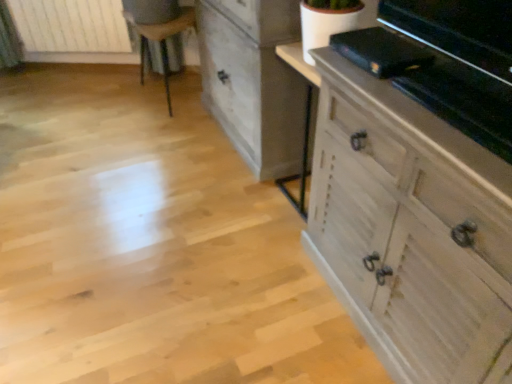
Identify the location of distressed white chest of drawers at center, which is the 1th chest of drawers in back-to-front order. (254, 81).

Describe the element at coordinates (163, 40) in the screenshot. I see `wooden chair at upper left` at that location.

Locate an element on the screen. white wood chest of drawers at right, which ranks as the 1th chest of drawers in front-to-back order is located at coordinates (409, 228).

In order to face white wood chest of drawers at right, the second chest of drawers positioned from the back, should I rotate leftwards or rightwards?

Rotate right and turn 23.214 degrees.

At what (x,y) coordinates should I click in order to perform the action: click on distressed white chest of drawers at center, which is the 1th chest of drawers in back-to-front order. Please return your answer as a coordinate pair (x, y). The height and width of the screenshot is (384, 512). Looking at the image, I should click on (254, 81).

From the image's perspective, which is below, wooden chair at upper left or distressed white chest of drawers at center, which is counted as the second chest of drawers, starting from the front?

From the image's view, distressed white chest of drawers at center, which is counted as the second chest of drawers, starting from the front, is below.

Does wooden chair at upper left touch distressed white chest of drawers at center, which is counted as the second chest of drawers, starting from the front?

No, wooden chair at upper left is not next to distressed white chest of drawers at center, which is counted as the second chest of drawers, starting from the front.

Would you say wooden chair at upper left is inside or outside distressed white chest of drawers at center, which is the 1th chest of drawers in back-to-front order?

wooden chair at upper left is not enclosed by distressed white chest of drawers at center, which is the 1th chest of drawers in back-to-front order.

Is wooden chair at upper left turned away from distressed white chest of drawers at center, which is the 1th chest of drawers in back-to-front order?

wooden chair at upper left is not turned away from distressed white chest of drawers at center, which is the 1th chest of drawers in back-to-front order.

From the image's perspective, is white wooden radiator at upper left positioned above or below distressed white chest of drawers at center, which is the 1th chest of drawers in back-to-front order?

Based on their image positions, white wooden radiator at upper left is located above distressed white chest of drawers at center, which is the 1th chest of drawers in back-to-front order.

Is distressed white chest of drawers at center, which is counted as the second chest of drawers, starting from the front, completely or partially inside white wooden radiator at upper left?

No, distressed white chest of drawers at center, which is counted as the second chest of drawers, starting from the front, is not inside white wooden radiator at upper left.

Considering the relative sizes of white wooden radiator at upper left and distressed white chest of drawers at center, which is counted as the second chest of drawers, starting from the front, in the image provided, is white wooden radiator at upper left bigger than distressed white chest of drawers at center, which is counted as the second chest of drawers, starting from the front,?

Incorrect, white wooden radiator at upper left is not larger than distressed white chest of drawers at center, which is counted as the second chest of drawers, starting from the front.

Is white wooden radiator at upper left facing away from distressed white chest of drawers at center, which is the 1th chest of drawers in back-to-front order?

No.

Based on the photo, from the image's perspective, is white wooden radiator at upper left over wooden chair at upper left?

Yes, from the image's perspective, white wooden radiator at upper left is over wooden chair at upper left.

Considering the relative sizes of white wooden radiator at upper left and wooden chair at upper left in the image provided, is white wooden radiator at upper left smaller than wooden chair at upper left?

Yes, white wooden radiator at upper left is smaller than wooden chair at upper left.

Is wooden chair at upper left surrounded by white wooden radiator at upper left?

No, wooden chair at upper left is located outside of white wooden radiator at upper left.

Considering the sizes of objects distressed white chest of drawers at center, which is counted as the second chest of drawers, starting from the front, and white wooden radiator at upper left in the image provided, who is thinner, distressed white chest of drawers at center, which is counted as the second chest of drawers, starting from the front, or white wooden radiator at upper left?

With smaller width is white wooden radiator at upper left.

Considering the relative positions of distressed white chest of drawers at center, which is the 1th chest of drawers in back-to-front order, and white wooden radiator at upper left in the image provided, is distressed white chest of drawers at center, which is the 1th chest of drawers in back-to-front order, in front of white wooden radiator at upper left?

Yes, it is.

From a real-world perspective, is distressed white chest of drawers at center, which is the 1th chest of drawers in back-to-front order, physically below white wooden radiator at upper left?

No, from a real-world perspective, distressed white chest of drawers at center, which is the 1th chest of drawers in back-to-front order, is not under white wooden radiator at upper left.

Does point (260, 153) come in front of point (121, 25)?

Yes, it is.

Is white wood chest of drawers at right, the second chest of drawers positioned from the back, positioned before wooden chair at upper left?

Yes, white wood chest of drawers at right, the second chest of drawers positioned from the back, is closer to the camera.

Which of these two, white wood chest of drawers at right, which ranks as the 1th chest of drawers in front-to-back order, or wooden chair at upper left, stands shorter?

With less height is wooden chair at upper left.

Can you confirm if white wood chest of drawers at right, the second chest of drawers positioned from the back, is thinner than wooden chair at upper left?

No, white wood chest of drawers at right, the second chest of drawers positioned from the back, is not thinner than wooden chair at upper left.

Considering the relative positions of white wood chest of drawers at right, the second chest of drawers positioned from the back, and white wooden radiator at upper left in the image provided, is white wood chest of drawers at right, the second chest of drawers positioned from the back, to the right of white wooden radiator at upper left from the viewer's perspective?

Yes, white wood chest of drawers at right, the second chest of drawers positioned from the back, is to the right of white wooden radiator at upper left.

Is white wood chest of drawers at right, which ranks as the 1th chest of drawers in front-to-back order, facing towards white wooden radiator at upper left?

No.

Is white wood chest of drawers at right, which ranks as the 1th chest of drawers in front-to-back order, completely or partially outside of white wooden radiator at upper left?

white wood chest of drawers at right, which ranks as the 1th chest of drawers in front-to-back order, is positioned outside white wooden radiator at upper left.

From a real-world perspective, is white wood chest of drawers at right, the second chest of drawers positioned from the back, physically below white wooden radiator at upper left?

No, from a real-world perspective, white wood chest of drawers at right, the second chest of drawers positioned from the back, is not under white wooden radiator at upper left.

Can you confirm if distressed white chest of drawers at center, which is the 1th chest of drawers in back-to-front order, is shorter than white wood chest of drawers at right, which ranks as the 1th chest of drawers in front-to-back order?

In fact, distressed white chest of drawers at center, which is the 1th chest of drawers in back-to-front order, may be taller than white wood chest of drawers at right, which ranks as the 1th chest of drawers in front-to-back order.

Is distressed white chest of drawers at center, which is counted as the second chest of drawers, starting from the front, positioned beyond the bounds of white wood chest of drawers at right, which ranks as the 1th chest of drawers in front-to-back order?

Indeed, distressed white chest of drawers at center, which is counted as the second chest of drawers, starting from the front, is completely outside white wood chest of drawers at right, which ranks as the 1th chest of drawers in front-to-back order.

Is distressed white chest of drawers at center, which is the 1th chest of drawers in back-to-front order, not close to white wood chest of drawers at right, which ranks as the 1th chest of drawers in front-to-back order?

No, distressed white chest of drawers at center, which is the 1th chest of drawers in back-to-front order, is not far away from white wood chest of drawers at right, which ranks as the 1th chest of drawers in front-to-back order.

Is point (271, 93) positioned after point (375, 232)?

Yes, it is behind point (375, 232).

At what (x,y) coordinates should I click in order to perform the action: click on the 1st chest of drawers below the wooden chair at upper left (from the image's perspective). Please return your answer as a coordinate pair (x, y). Image resolution: width=512 pixels, height=384 pixels. Looking at the image, I should click on (254, 81).

Find the location of a particular element. The height and width of the screenshot is (384, 512). the chest of drawers that is the 2nd object above the white wooden radiator at upper left (from a real-world perspective) is located at coordinates (254, 81).

Considering their positions, is white wooden radiator at upper left positioned further to wooden chair at upper left than distressed white chest of drawers at center, which is the 1th chest of drawers in back-to-front order?

Among the two, white wooden radiator at upper left is located further to wooden chair at upper left.

Which object lies nearer to the anchor point distressed white chest of drawers at center, which is counted as the second chest of drawers, starting from the front, white wood chest of drawers at right, the second chest of drawers positioned from the back, or white wooden radiator at upper left?

Based on the image, white wood chest of drawers at right, the second chest of drawers positioned from the back, appears to be nearer to distressed white chest of drawers at center, which is counted as the second chest of drawers, starting from the front.

Based on their spatial positions, is distressed white chest of drawers at center, which is the 1th chest of drawers in back-to-front order, or wooden chair at upper left further from white wood chest of drawers at right, the second chest of drawers positioned from the back?

The object further to white wood chest of drawers at right, the second chest of drawers positioned from the back, is wooden chair at upper left.

From the image, which object appears to be farther from wooden chair at upper left, distressed white chest of drawers at center, which is counted as the second chest of drawers, starting from the front, or white wood chest of drawers at right, the second chest of drawers positioned from the back?

white wood chest of drawers at right, the second chest of drawers positioned from the back.

Estimate the real-world distances between objects in this image. Which object is closer to white wooden radiator at upper left, wooden chair at upper left or white wood chest of drawers at right, which ranks as the 1th chest of drawers in front-to-back order?

Among the two, wooden chair at upper left is located nearer to white wooden radiator at upper left.

Based on their spatial positions, is wooden chair at upper left or white wooden radiator at upper left closer to white wood chest of drawers at right, the second chest of drawers positioned from the back?

Result: wooden chair at upper left is closer to white wood chest of drawers at right, the second chest of drawers positioned from the back.

Considering their positions, is wooden chair at upper left positioned closer to white wooden radiator at upper left than distressed white chest of drawers at center, which is the 1th chest of drawers in back-to-front order?

Based on the image, wooden chair at upper left appears to be nearer to white wooden radiator at upper left.

Estimate the real-world distances between objects in this image. Which object is closer to distressed white chest of drawers at center, which is counted as the second chest of drawers, starting from the front, wooden chair at upper left or white wood chest of drawers at right, the second chest of drawers positioned from the back?

Based on the image, wooden chair at upper left appears to be nearer to distressed white chest of drawers at center, which is counted as the second chest of drawers, starting from the front.

You are a GUI agent. You are given a task and a screenshot of the screen. Output one action in this format:
    pyautogui.click(x=<x>, y=<y>)
    Task: Click on the furniture located between white wood chest of drawers at right, the second chest of drawers positioned from the back, and white wooden radiator at upper left in the depth direction
    Image resolution: width=512 pixels, height=384 pixels.
    Given the screenshot: What is the action you would take?
    (163, 40)

Identify the location of furniture located between white wooden radiator at upper left and distressed white chest of drawers at center, which is the 1th chest of drawers in back-to-front order, in the left-right direction. (163, 40).

You are a GUI agent. You are given a task and a screenshot of the screen. Output one action in this format:
    pyautogui.click(x=<x>, y=<y>)
    Task: Click on the chest of drawers between white wood chest of drawers at right, the second chest of drawers positioned from the back, and white wooden radiator at upper left from front to back
    
    Given the screenshot: What is the action you would take?
    pyautogui.click(x=254, y=81)

Identify the location of chest of drawers between white wood chest of drawers at right, the second chest of drawers positioned from the back, and wooden chair at upper left in the front-back direction. The height and width of the screenshot is (384, 512). tap(254, 81).